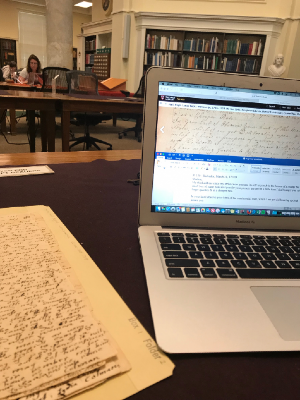
Find the location of `keyboard`. keyboard is located at coordinates (205, 247).